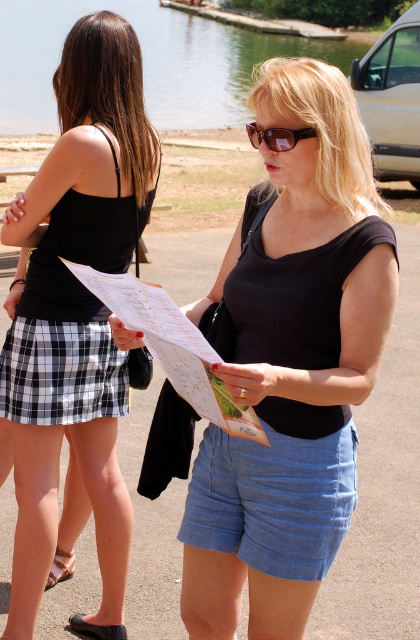
Question: Can you confirm if black plaid skirt at left is positioned below denim shorts at center?

Choices:
 (A) no
 (B) yes

Answer: (A)

Question: From the image, what is the correct spatial relationship of denim shorts at center in relation to sunglasses at center?

Choices:
 (A) below
 (B) above

Answer: (A)

Question: Is black matte shirt at center below denim shorts at center?

Choices:
 (A) yes
 (B) no

Answer: (B)

Question: Which point is farther to the camera?

Choices:
 (A) (109, 58)
 (B) (291, 531)
 (C) (277, 150)
 (D) (315, 340)

Answer: (A)

Question: Which is farther from the sunglasses at center?

Choices:
 (A) black plaid skirt at left
 (B) black matte shirt at center

Answer: (A)

Question: Which of the following is the closest to the observer?

Choices:
 (A) (252, 140)
 (B) (94, 99)
 (C) (217, 509)

Answer: (A)